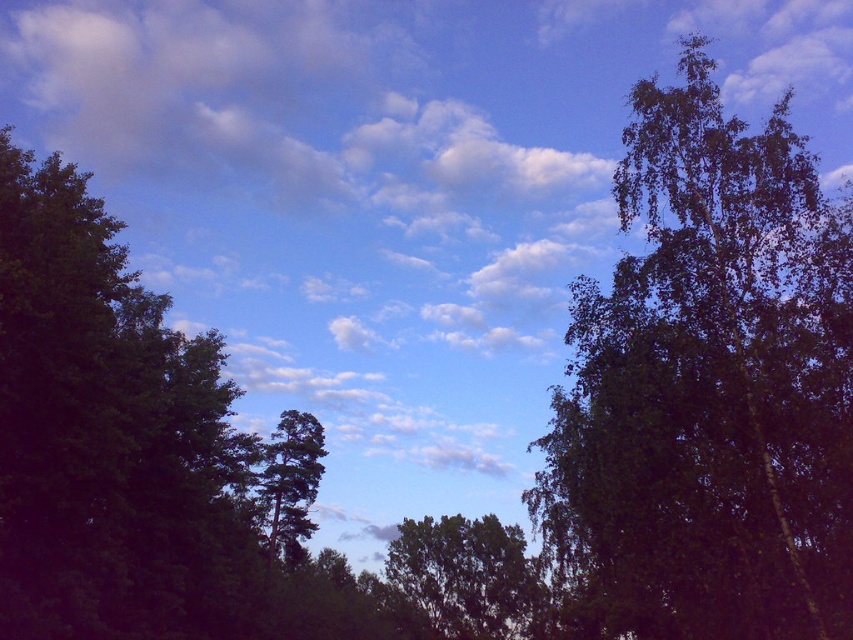
You are standing in a field and see two trees, the green leafy tree at center and the green matte tree at center. If you want to walk to the nearest tree, which one should you head towards?

The green leafy tree at center is 23.26 meters away from the green matte tree at center. Without knowing your current position relative to both trees, it is impossible to determine which one is closer to you.

You are a bird looking for a place to perch. You see the green leafy tree at right and the green matte tree at center. Which tree is positioned higher in the sky?

The green leafy tree at right is positioned higher in the sky than the green matte tree at center.

From the picture: You are a bird flying between the green leafy tree at right and the green matte tree at center. If your wingspan is 4 feet, can you safely fly between them without touching either tree?

The distance between the green leafy tree at right and the green matte tree at center is 83.31 feet. Since your wingspan is only 4 feet, there is ample space to fly between them safely.